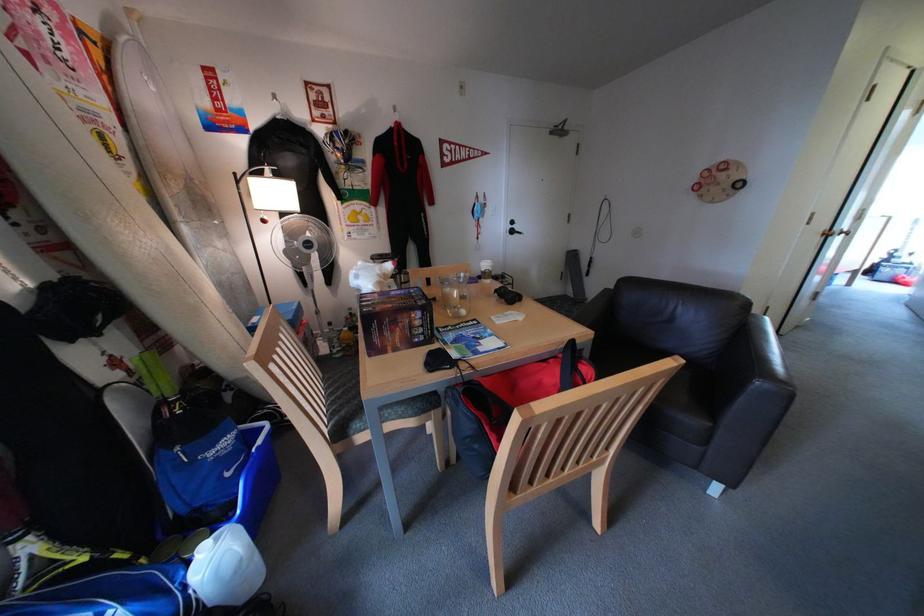
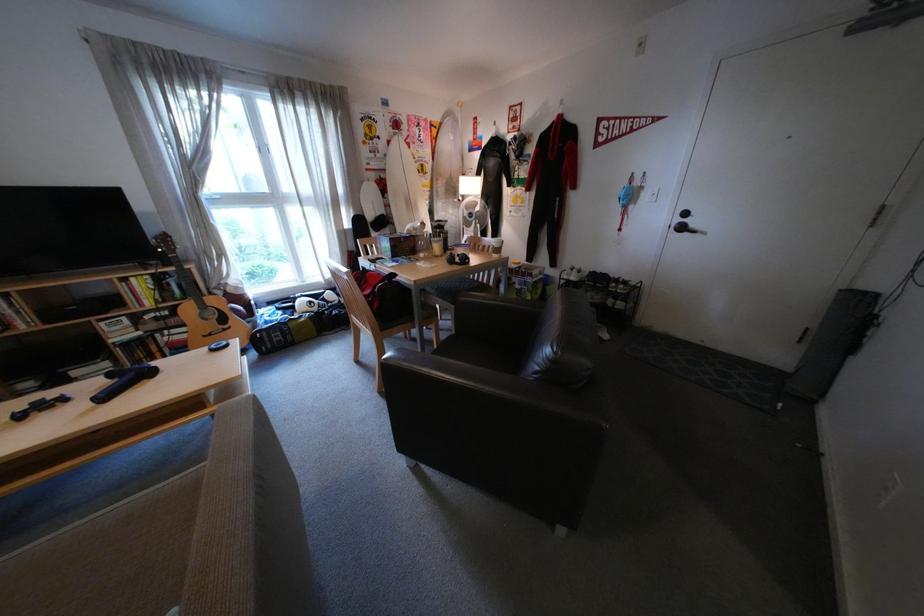
In the second image, find the point that corresponds to the point at 526,233 in the first image.

(696, 229)